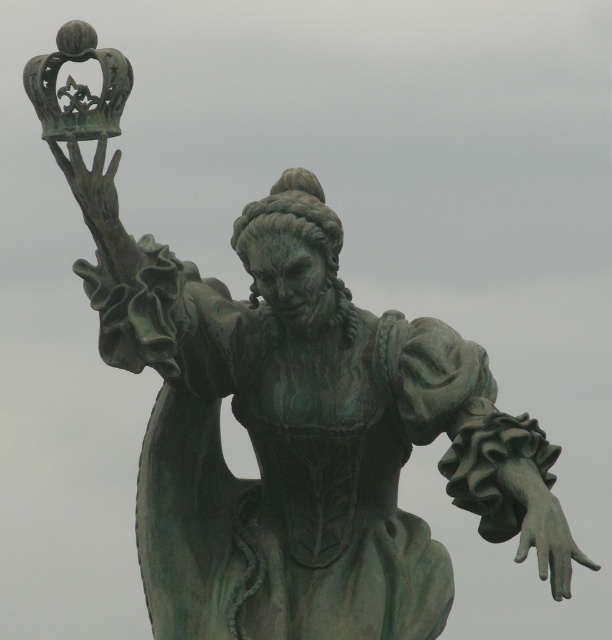
Question: Is green patina hand at lower right smaller than green patina crown at upper left?

Choices:
 (A) no
 (B) yes

Answer: (B)

Question: Is green patina hand at lower right to the right of green patina crown at upper left from the viewer's perspective?

Choices:
 (A) yes
 (B) no

Answer: (A)

Question: Which of the following is the farthest from the observer?

Choices:
 (A) (91, 195)
 (B) (509, 492)

Answer: (B)

Question: Which point is closer to the camera?

Choices:
 (A) (64, 156)
 (B) (523, 460)

Answer: (A)

Question: Does green patina hand at lower right have a lesser width compared to green patina crown at upper left?

Choices:
 (A) yes
 (B) no

Answer: (A)